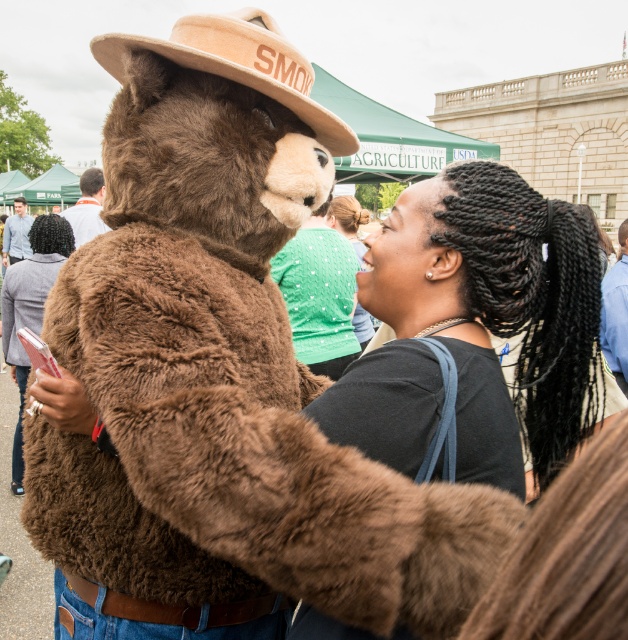
You are at a festival and see the black matte hair at upper right and the beige felt hat at upper center. Which object is positioned lower in the image?

The black matte hair at upper right is located below the beige felt hat at upper center, so it is positioned lower in the image.

You are standing at the center of the image and want to locate the black matte hair at upper right. According to the coordinates provided, in which direction should you turn to face it?

The black matte hair at upper right is located at point (477, 328), which is to the upper right direction from the center. Therefore, you should turn to your upper right to face it.